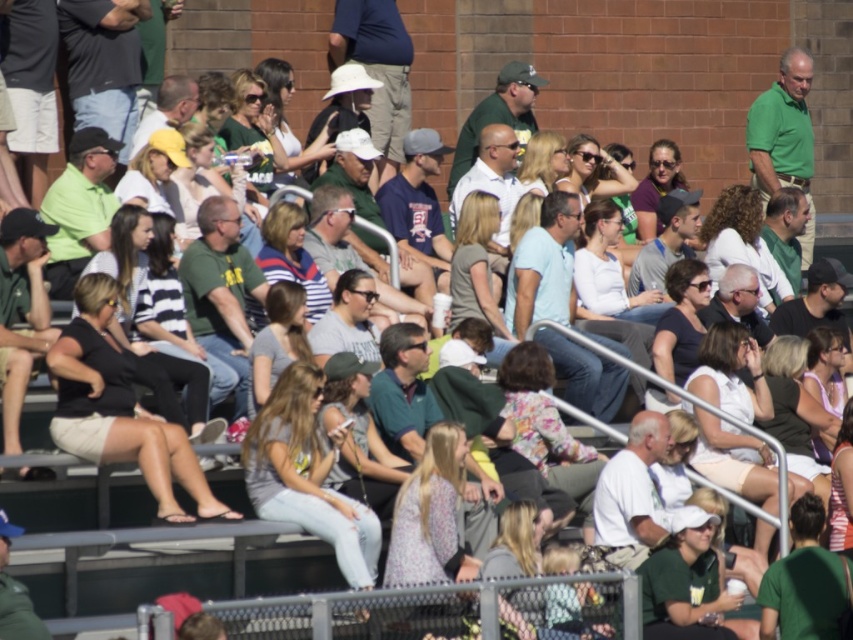
You are attending the event and want to find the green jersey at center. Based on the coordinates provided, where should you look relative to the bleachers and brick wall?

The green jersey at center is located at coordinates point (804, 580), which places it near the lower part of the bleachers closer to the brick wall.

You are standing at point (465,228) and want to walk to the entrance located at point (833,560). Considering the tiered bleachers and the crowd, will you have a clear path to the entrance?

Point (833,560) is in front of point (465,228), so yes, you will have a clear path to the entrance as it is directly in front of your current position.